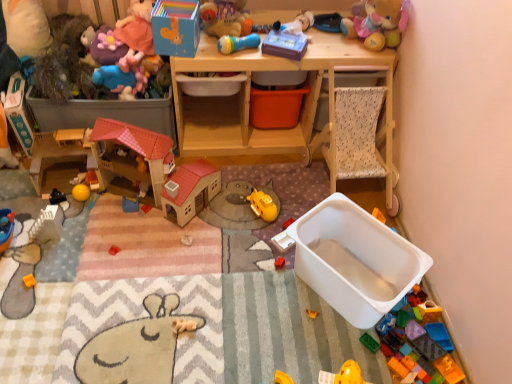
Where is `yellow matte submarine at center, marked as the 9th toy in a left-to-right arrangement`? The image size is (512, 384). yellow matte submarine at center, marked as the 9th toy in a left-to-right arrangement is located at coordinates (262, 205).

Identify the location of rubberized plastic microphone at upper center, which is the eighth toy from left to right. (237, 43).

What is the approximate height of matte blue box at upper left, arranged as the seventh toy when viewed from the right?

The height of matte blue box at upper left, arranged as the seventh toy when viewed from the right, is 15.08 inches.

The height and width of the screenshot is (384, 512). What are the coordinates of `translucent plastic car at lower right, placed as the 12th toy when sorted from left to right` in the screenshot? It's located at (429, 311).

The height and width of the screenshot is (384, 512). Describe the element at coordinates (176, 27) in the screenshot. I see `matte blue box at upper center, the 7th toy from the left` at that location.

I want to click on purple plush toy at upper left, arranged as the tenth toy when viewed from the right, so click(x=102, y=46).

Consider the image. From a real-world perspective, between white plastic toy at center, arranged as the third toy when viewed from the right, and yellow rubber ball at center-left, which is the 11th toy from right to left, who is vertically higher?

yellow rubber ball at center-left, which is the 11th toy from right to left, is physically above.

Starting from the white plastic toy at center, arranged as the tenth toy when viewed from the left, which toy is the 4th one behind? Please provide its 2D coordinates.

[(81, 192)]

Which of these two, white plastic toy at center, arranged as the tenth toy when viewed from the left, or yellow rubber ball at center-left, the second toy positioned from the left, stands shorter?

white plastic toy at center, arranged as the tenth toy when viewed from the left, is shorter.

In terms of size, does matte blue rubber duck at upper left, which is counted as the 4th toy, starting from the left, appear bigger or smaller than translucent plastic car at lower right, placed as the 1th toy when sorted from right to left?

matte blue rubber duck at upper left, which is counted as the 4th toy, starting from the left, is bigger than translucent plastic car at lower right, placed as the 1th toy when sorted from right to left.

From the picture: From the image's perspective, which one is positioned lower, matte blue rubber duck at upper left, which is counted as the 4th toy, starting from the left, or translucent plastic car at lower right, placed as the 12th toy when sorted from left to right?

From the image's view, translucent plastic car at lower right, placed as the 12th toy when sorted from left to right, is below.

Is the depth of matte blue rubber duck at upper left, which is counted as the 4th toy, starting from the left, less than that of translucent plastic car at lower right, placed as the 1th toy when sorted from right to left?

No, it is not.

Can you confirm if yellow matte submarine at center, which appears as the fourth toy when viewed from the right, is wider than soft plush toy at upper right, positioned as the second toy in right-to-left order?

Incorrect, the width of yellow matte submarine at center, which appears as the fourth toy when viewed from the right, does not surpass that of soft plush toy at upper right, positioned as the second toy in right-to-left order.

In terms of height, does yellow matte submarine at center, which appears as the fourth toy when viewed from the right, look taller or shorter compared to soft plush toy at upper right, arranged as the 11th toy when viewed from the left?

yellow matte submarine at center, which appears as the fourth toy when viewed from the right, is shorter than soft plush toy at upper right, arranged as the 11th toy when viewed from the left.

This screenshot has height=384, width=512. I want to click on the 8th toy above the yellow matte submarine at center, marked as the 9th toy in a left-to-right arrangement (from a real-world perspective), so click(377, 22).

Consider the image. From a real-world perspective, is wooden desk at upper center on white plastic toy at center, arranged as the tenth toy when viewed from the left?

Indeed, from a real-world perspective, wooden desk at upper center stands above white plastic toy at center, arranged as the tenth toy when viewed from the left.

Can you tell me how much wooden desk at upper center and white plastic toy at center, arranged as the third toy when viewed from the right, differ in facing direction?

The angle between the facing direction of wooden desk at upper center and the facing direction of white plastic toy at center, arranged as the third toy when viewed from the right, is 55.4 degrees.

How far apart are wooden desk at upper center and white plastic toy at center, arranged as the third toy when viewed from the right?

wooden desk at upper center is 25.10 inches away from white plastic toy at center, arranged as the third toy when viewed from the right.

Based on the photo, considering the relative positions of wooden desk at upper center and white plastic toy at center, arranged as the tenth toy when viewed from the left, in the image provided, is wooden desk at upper center to the left or to the right of white plastic toy at center, arranged as the tenth toy when viewed from the left,?

From the image, it's evident that wooden desk at upper center is to the left of white plastic toy at center, arranged as the tenth toy when viewed from the left.

Does point (271, 201) come farther from viewer compared to point (272, 241)?

Yes, point (271, 201) is behind point (272, 241).

Where is `the 2nd toy below when counting from the yellow matte submarine at center, which appears as the fourth toy when viewed from the right (from the image's perspective)`? The width and height of the screenshot is (512, 384). the 2nd toy below when counting from the yellow matte submarine at center, which appears as the fourth toy when viewed from the right (from the image's perspective) is located at coordinates (283, 238).

Is yellow matte submarine at center, marked as the 9th toy in a left-to-right arrangement, turned away from white plastic toy at center, arranged as the tenth toy when viewed from the left?

No.

Would you consider plastic toy car at upper left, which ranks as the 12th toy in right-to-left order, to be distant from yellow matte submarine at center, which appears as the fourth toy when viewed from the right?

Absolutely, plastic toy car at upper left, which ranks as the 12th toy in right-to-left order, is distant from yellow matte submarine at center, which appears as the fourth toy when viewed from the right.

Is plastic toy car at upper left, which ranks as the 12th toy in right-to-left order, shorter than yellow matte submarine at center, which appears as the fourth toy when viewed from the right?

No, plastic toy car at upper left, which ranks as the 12th toy in right-to-left order, is not shorter than yellow matte submarine at center, which appears as the fourth toy when viewed from the right.

From the plastic toy car at upper left, which ranks as the 12th toy in right-to-left order, count 4th toys forward and point to it. Please provide its 2D coordinates.

[(262, 205)]

Choose the correct answer: Is purple plush toy at upper left, arranged as the tenth toy when viewed from the right, inside matte blue box at upper center, the 7th toy from the left, or outside it?

purple plush toy at upper left, arranged as the tenth toy when viewed from the right, is located beyond the bounds of matte blue box at upper center, the 7th toy from the left.

From the image's perspective, is purple plush toy at upper left, which is the third toy in left-to-right order, positioned above or below matte blue box at upper center, acting as the sixth toy starting from the right?

purple plush toy at upper left, which is the third toy in left-to-right order, is situated higher than matte blue box at upper center, acting as the sixth toy starting from the right, in the image.

In terms of size, does purple plush toy at upper left, arranged as the tenth toy when viewed from the right, appear bigger or smaller than matte blue box at upper center, the 7th toy from the left?

purple plush toy at upper left, arranged as the tenth toy when viewed from the right, is smaller than matte blue box at upper center, the 7th toy from the left.

Image resolution: width=512 pixels, height=384 pixels. Identify the location of the 8th toy counting from the right side of the yellow rubber ball at center-left, the second toy positioned from the left. (283, 238).

From a real-world perspective, count 5th toys upward from the translucent plastic car at lower right, placed as the 12th toy when sorted from left to right, and point to it. Please provide its 2D coordinates.

[(123, 76)]

Which object lies nearer to the anchor point matte blue box at upper left, arranged as the seventh toy when viewed from the right, plastic toy car at upper left, which ranks as the 12th toy in right-to-left order, or rubberized plastic microphone at upper center, which is counted as the fifth toy, starting from the right?

Among the two, plastic toy car at upper left, which ranks as the 12th toy in right-to-left order, is located nearer to matte blue box at upper left, arranged as the seventh toy when viewed from the right.

Considering their positions, is purple plush toy at upper left, arranged as the tenth toy when viewed from the right, positioned closer to soft plush toy at upper right, positioned as the second toy in right-to-left order, than plastic toy car at upper left, which ranks as the 12th toy in right-to-left order?

purple plush toy at upper left, arranged as the tenth toy when viewed from the right, lies closer to soft plush toy at upper right, positioned as the second toy in right-to-left order, than the other object.

Which object lies further to the anchor point wooden desk at upper center, plastic toy car at upper left, which ranks as the 12th toy in right-to-left order, or matte blue box at upper center, acting as the sixth toy starting from the right?

plastic toy car at upper left, which ranks as the 12th toy in right-to-left order, is positioned further to the anchor wooden desk at upper center.

From the image, which object appears to be nearer to yellow rubber ball at center-left, which is the 11th toy from right to left, wooden desk at upper center or blue plastic toy at center, the 5th toy viewed from the left?

blue plastic toy at center, the 5th toy viewed from the left, lies closer to yellow rubber ball at center-left, which is the 11th toy from right to left, than the other object.

From the image, which object appears to be nearer to soft plush toy at upper right, positioned as the second toy in right-to-left order, wooden desk at upper center or blue plastic toy at center, the 5th toy viewed from the left?

wooden desk at upper center.

Considering their positions, is matte blue rubber duck at upper left, the 9th toy when ordered from right to left, positioned further to purple plush toy at upper left, which is the third toy in left-to-right order, than plastic toy car at upper left, which ranks as the 12th toy in right-to-left order?

Based on the image, plastic toy car at upper left, which ranks as the 12th toy in right-to-left order, appears to be further to purple plush toy at upper left, which is the third toy in left-to-right order.

From the picture: Considering their positions, is plastic toy car at upper left, which ranks as the 12th toy in right-to-left order, positioned further to white plastic toy at center, arranged as the third toy when viewed from the right, than purple plush toy at upper left, arranged as the tenth toy when viewed from the right?

plastic toy car at upper left, which ranks as the 12th toy in right-to-left order, lies further to white plastic toy at center, arranged as the third toy when viewed from the right, than the other object.

From the picture: Estimate the real-world distances between objects in this image. Which object is closer to plastic toy car at upper left, which ranks as the 12th toy in right-to-left order, rubberized plastic microphone at upper center, which is the eighth toy from left to right, or matte blue rubber duck at upper left, which is counted as the 4th toy, starting from the left?

matte blue rubber duck at upper left, which is counted as the 4th toy, starting from the left, lies closer to plastic toy car at upper left, which ranks as the 12th toy in right-to-left order, than the other object.

Where is `desk between rubberized plastic microphone at upper center, which is the eighth toy from left to right, and soft plush toy at upper right, positioned as the second toy in right-to-left order, in the horizontal direction`? The width and height of the screenshot is (512, 384). desk between rubberized plastic microphone at upper center, which is the eighth toy from left to right, and soft plush toy at upper right, positioned as the second toy in right-to-left order, in the horizontal direction is located at coordinates (248, 99).

This screenshot has width=512, height=384. I want to click on desk between rubberized plastic microphone at upper center, which is counted as the fifth toy, starting from the right, and white plastic toy at center, arranged as the third toy when viewed from the right, from top to bottom, so click(x=248, y=99).

This screenshot has height=384, width=512. In order to click on toy between matte blue box at upper left, arranged as the seventh toy when viewed from the right, and rubberized plastic microphone at upper center, which is the eighth toy from left to right in this screenshot , I will do `click(176, 27)`.

Locate an element on the screen. The width and height of the screenshot is (512, 384). toy that lies between matte blue rubber duck at upper left, which is counted as the 4th toy, starting from the left, and yellow rubber ball at center-left, which is the 11th toy from right to left, from top to bottom is located at coordinates (19, 113).